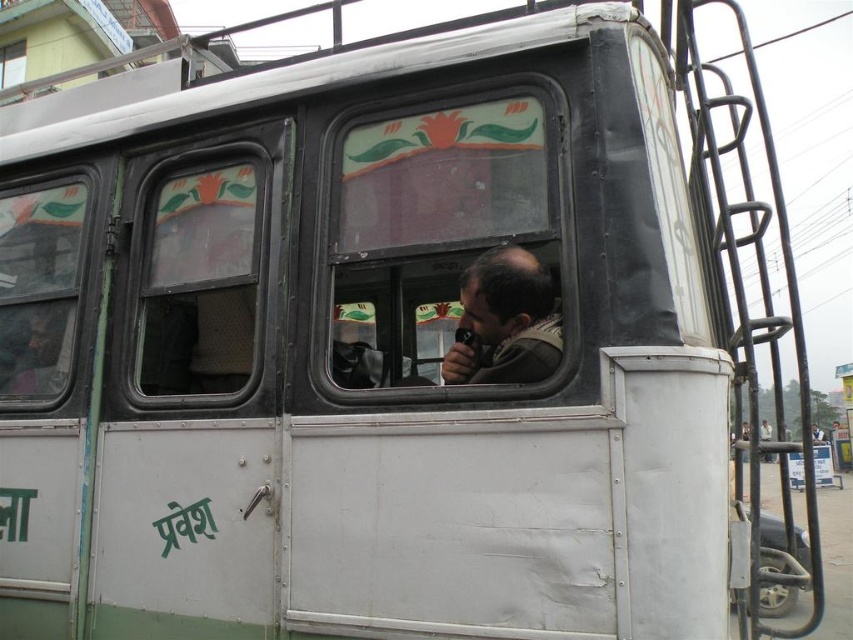
Does clear glass window at center left have a lesser height compared to dark brown leather jacket at center?

Incorrect, clear glass window at center left's height does not fall short of dark brown leather jacket at center's.

Who is lower down, clear glass window at center left or dark brown leather jacket at center?

dark brown leather jacket at center is lower down.

Identify the location of clear glass window at center left. This screenshot has width=853, height=640. (201, 278).

Identify the location of clear glass window at center left. The width and height of the screenshot is (853, 640). (201, 278).

Looking at this image, can you confirm if transparent glass window at center is positioned above dark brown leather jacket at center?

Indeed, transparent glass window at center is positioned over dark brown leather jacket at center.

Does point (547, 246) come closer to viewer compared to point (445, 376)?

Yes, point (547, 246) is in front of point (445, 376).

Between point (558, 124) and point (467, 348), which one is positioned behind?

Positioned behind is point (467, 348).

The height and width of the screenshot is (640, 853). I want to click on transparent glass window at center, so click(x=433, y=221).

Is point (230, 168) farther from viewer compared to point (59, 376)?

No.

Does clear glass window at center left appear under clear glass window at left?

Yes, clear glass window at center left is below clear glass window at left.

Describe the element at coordinates (201, 278) in the screenshot. This screenshot has width=853, height=640. I see `clear glass window at center left` at that location.

Locate an element on the screen. This screenshot has height=640, width=853. clear glass window at center left is located at coordinates (201, 278).